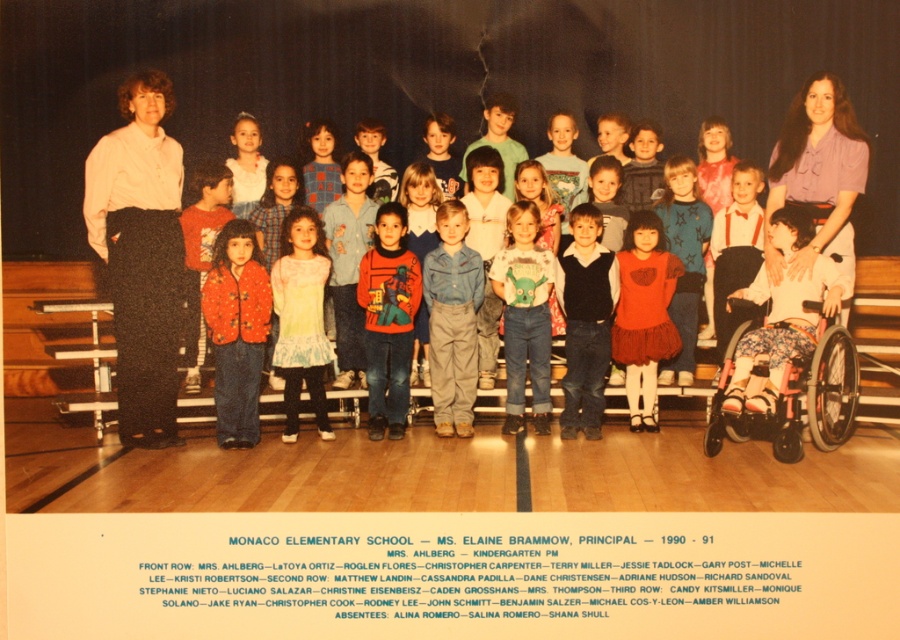
Does floral-patterned jacket at center have a larger size compared to matte red sweater at center?

Yes.

From the picture: Who is positioned more to the right, floral-patterned jacket at center or matte red sweater at center?

matte red sweater at center is more to the right.

Who is more distant from viewer, (225, 244) or (378, 364)?

Point (378, 364)

Identify the location of floral-patterned jacket at center. (237, 330).

Is floral fabric wheelchair at lower right to the left of floral-patterned jacket at center from the viewer's perspective?

No, floral fabric wheelchair at lower right is not to the left of floral-patterned jacket at center.

Who is more forward, (801, 420) or (234, 220)?

Positioned in front is point (801, 420).

Is point (777, 452) more distant than point (234, 422)?

No, (777, 452) is in front of (234, 422).

Find the location of `floral fabric wheelchair at lower right`. floral fabric wheelchair at lower right is located at coordinates (793, 396).

Consider the image. Can you confirm if matte black vest at center is smaller than light blue textured dress at center?

Correct, matte black vest at center occupies less space than light blue textured dress at center.

Who is more forward, (580, 259) or (306, 253)?

Point (306, 253)

Consider the image. Who is more distant from viewer, (595, 339) or (315, 324)?

The point (595, 339) is more distant.

The width and height of the screenshot is (900, 640). Find the location of `matte black vest at center`. matte black vest at center is located at coordinates (586, 323).